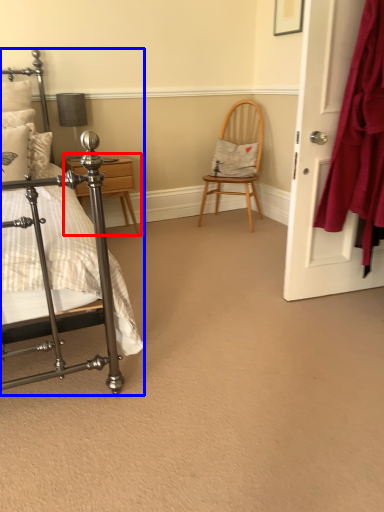
Question: Which object appears closest to the camera in this image, nightstand (highlighted by a red box) or bed (highlighted by a blue box)?

Choices:
 (A) nightstand
 (B) bed

Answer: (B)